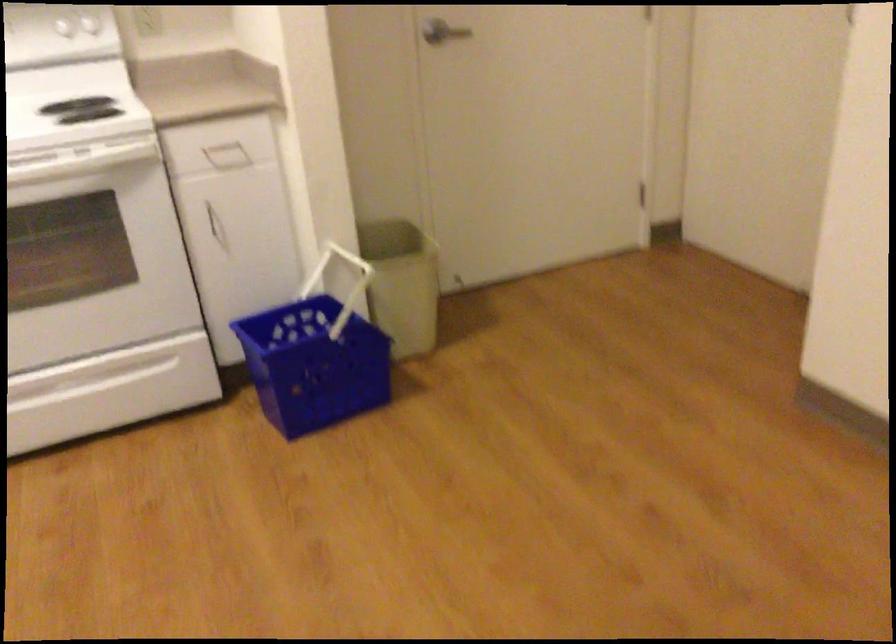
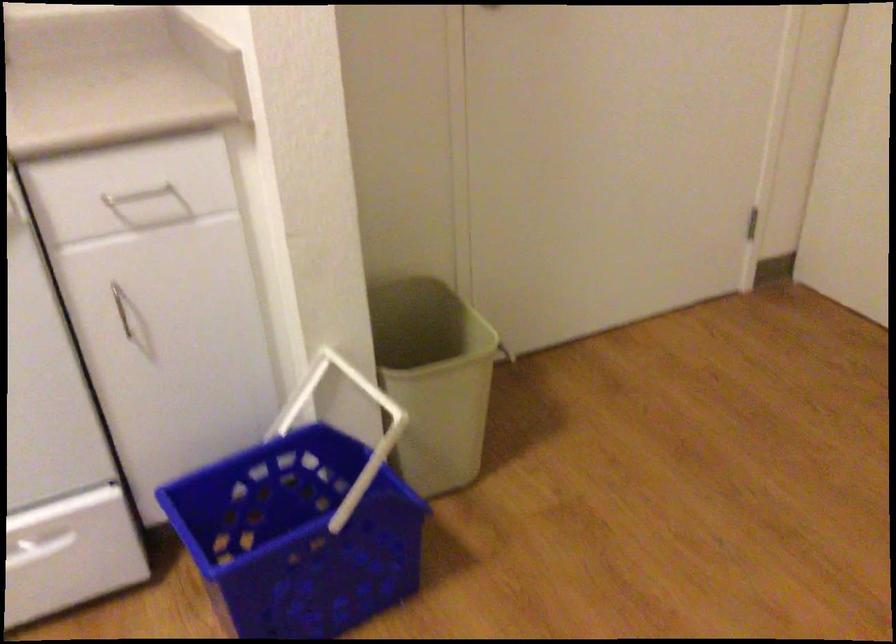
Where in the second image is the point corresponding to point 341,281 from the first image?

(343, 402)